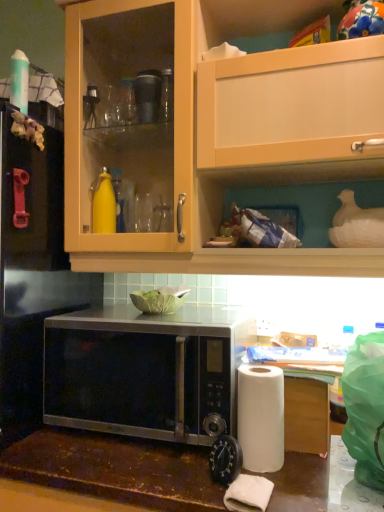
Question: From the image's perspective, is matte wood cabinet at upper center positioned above or below black metallic microwave at center?

Choices:
 (A) above
 (B) below

Answer: (A)

Question: Is matte wood cabinet at upper center wider or thinner than black metallic microwave at center?

Choices:
 (A) wide
 (B) thin

Answer: (B)

Question: Which object is positioned closest to the matte wood cabinet at upper center?

Choices:
 (A) black metallic microwave at center
 (B) white paper at lower right
 (C) white matte paper towel at lower right
 (D) black matte microwave at lower center

Answer: (D)

Question: Estimate the real-world distances between objects in this image. Which object is closer to the black matte microwave at lower center?

Choices:
 (A) white matte paper towel at lower right
 (B) black metallic microwave at center
 (C) matte wood cabinet at upper center
 (D) white paper at lower right

Answer: (B)